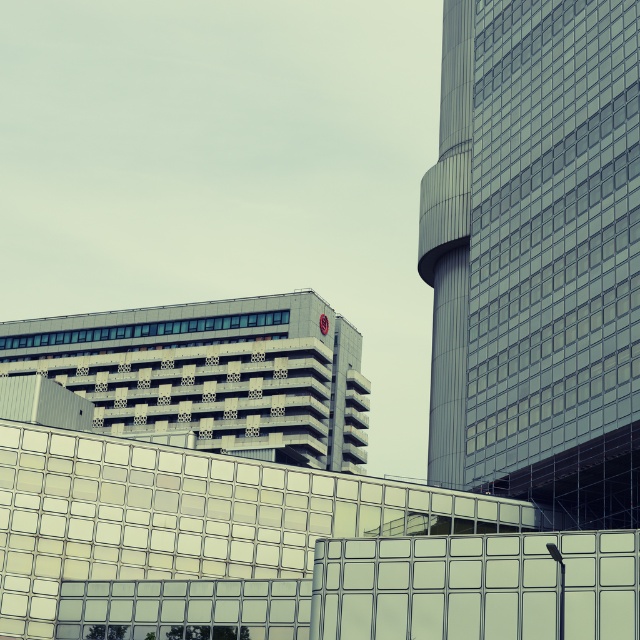
Based on the photo, how much distance is there between glassy steel tower at right and gray concrete building at upper left?

The distance of glassy steel tower at right from gray concrete building at upper left is 50.89 meters.

The image size is (640, 640). What do you see at coordinates (536, 257) in the screenshot?
I see `glassy steel tower at right` at bounding box center [536, 257].

Where is `glassy steel tower at right`? The width and height of the screenshot is (640, 640). glassy steel tower at right is located at coordinates (536, 257).